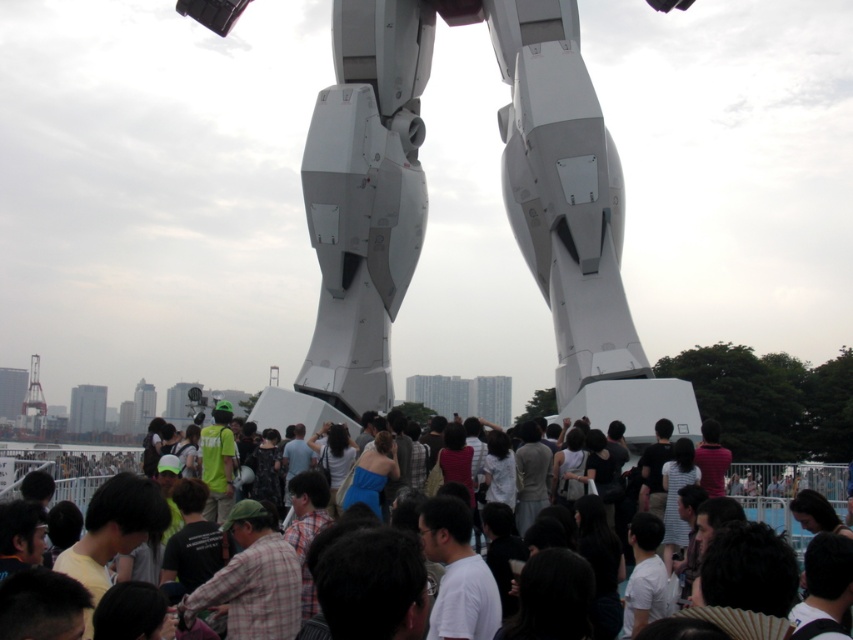
Question: Which point is closer to the camera?

Choices:
 (A) (751, 502)
 (B) (576, 104)

Answer: (B)

Question: Is white matte robot legs at center below matte white crowd at center?

Choices:
 (A) yes
 (B) no

Answer: (B)

Question: Which object appears closest to the camera in this image?

Choices:
 (A) matte white crowd at center
 (B) white matte robot legs at center

Answer: (A)

Question: Is white matte robot legs at center in front of matte white crowd at center?

Choices:
 (A) no
 (B) yes

Answer: (A)

Question: Can you confirm if white matte robot legs at center is positioned above matte white crowd at center?

Choices:
 (A) yes
 (B) no

Answer: (A)